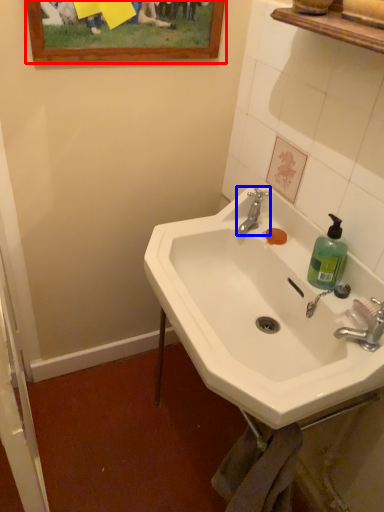
Question: Which object is further to the camera taking this photo, picture frame (highlighted by a red box) or tap (highlighted by a blue box)?

Choices:
 (A) picture frame
 (B) tap

Answer: (B)